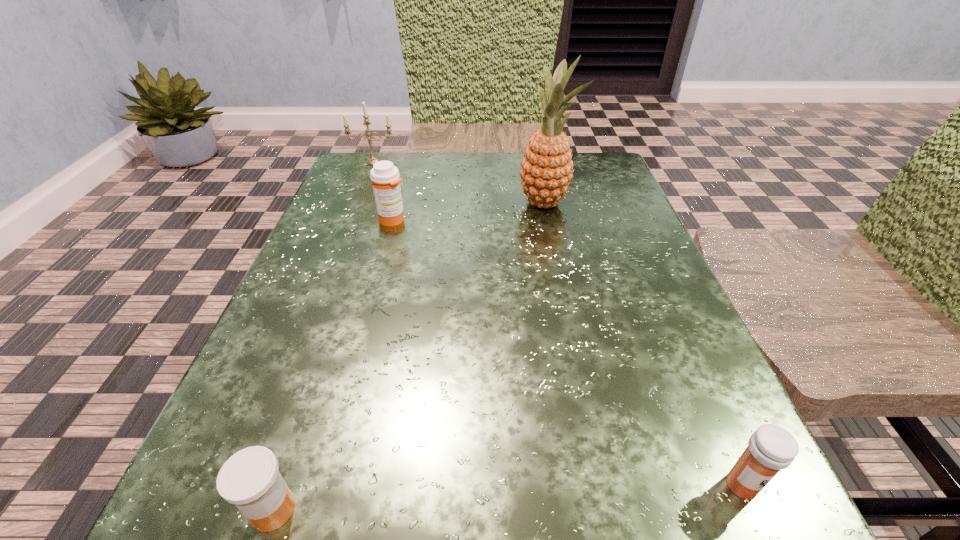
The width and height of the screenshot is (960, 540). In the image, there is a desktop. What are the coordinates of `free region at the left edge` in the screenshot? It's located at (273, 364).

Image resolution: width=960 pixels, height=540 pixels. Identify the location of vacant area at the right edge. (690, 415).

Locate an element on the screen. Image resolution: width=960 pixels, height=540 pixels. vacant region at the far left corner of the desktop is located at coordinates (363, 155).

Where is `unoccupied position between the candle and the rightmost object`? unoccupied position between the candle and the rightmost object is located at coordinates (558, 323).

This screenshot has height=540, width=960. I want to click on free space between the third tallest object and the pineapple, so click(x=468, y=211).

In order to click on free space between the rightmost medicine and the tallest object in this screenshot , I will do `click(643, 344)`.

Find the location of a particular element. Image resolution: width=960 pixels, height=540 pixels. free spot between the rightmost medicine and the tallest medicine is located at coordinates tap(567, 353).

This screenshot has height=540, width=960. What are the coordinates of `free area in between the rightmost object and the tallest medicine` in the screenshot? It's located at (567, 353).

Locate an element on the screen. This screenshot has width=960, height=540. object that can be found as the closest to the tallest medicine is located at coordinates (372, 159).

The height and width of the screenshot is (540, 960). Identify the location of object that is the third closest to the tallest medicine. (250, 479).